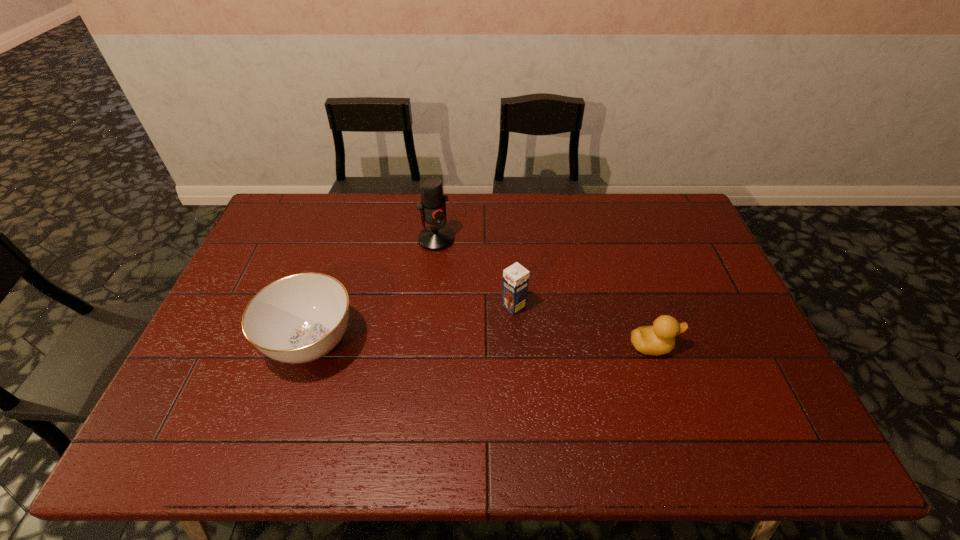
Locate an element on the screen. The width and height of the screenshot is (960, 540). the leftmost object is located at coordinates (300, 318).

Where is `duckling`? duckling is located at coordinates point(657,339).

This screenshot has width=960, height=540. In order to click on the shortest object in this screenshot , I will do (x=657, y=339).

Where is `microphone`? The image size is (960, 540). microphone is located at coordinates (432, 207).

This screenshot has height=540, width=960. Identify the location of the farthest object. (432, 207).

The width and height of the screenshot is (960, 540). What are the coordinates of `chocolate milk` in the screenshot? It's located at (515, 278).

This screenshot has height=540, width=960. In order to click on free space located on the right of the chinaware in this screenshot , I will do `click(500, 343)`.

The width and height of the screenshot is (960, 540). I want to click on vacant space positioned on the face of the rightmost object, so click(x=709, y=346).

Image resolution: width=960 pixels, height=540 pixels. Find the location of `vacant space located on the side of the tallest object with the red ring`. vacant space located on the side of the tallest object with the red ring is located at coordinates (502, 329).

Locate an element on the screen. vacant space situated on the side of the tallest object with the red ring is located at coordinates (502, 329).